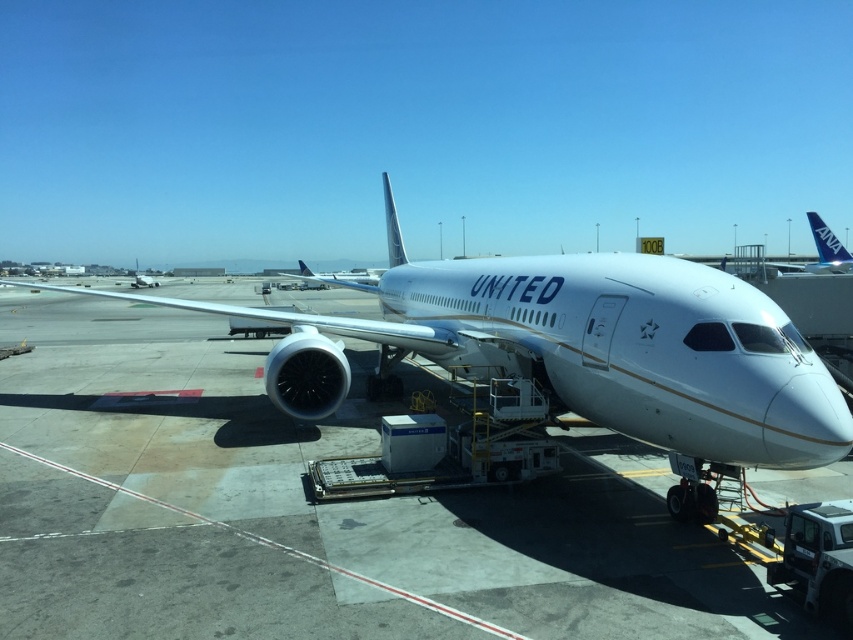
In the scene shown: You are a passenger standing at the jet bridge entrance. You see the white glossy airplane at center represented by point (579, 349). Where should you walk to board the airplane?

The white glossy airplane at center is represented by point (579, 349), so you should walk straight ahead along the jet bridge towards the point to board the airplane.

You are standing at the airport gate and want to locate the blue metallic airplane at upper right. According to the image coordinates, where exactly is it positioned?

The blue metallic airplane at upper right is positioned at point coordinates of (x=817, y=253).